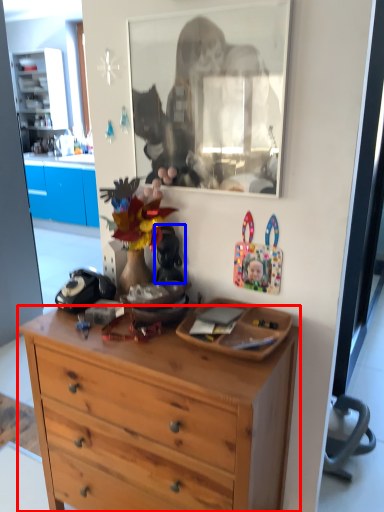
Question: Among these objects, which one is farthest to the camera, desk (highlighted by a red box) or toy (highlighted by a blue box)?

Choices:
 (A) desk
 (B) toy

Answer: (B)